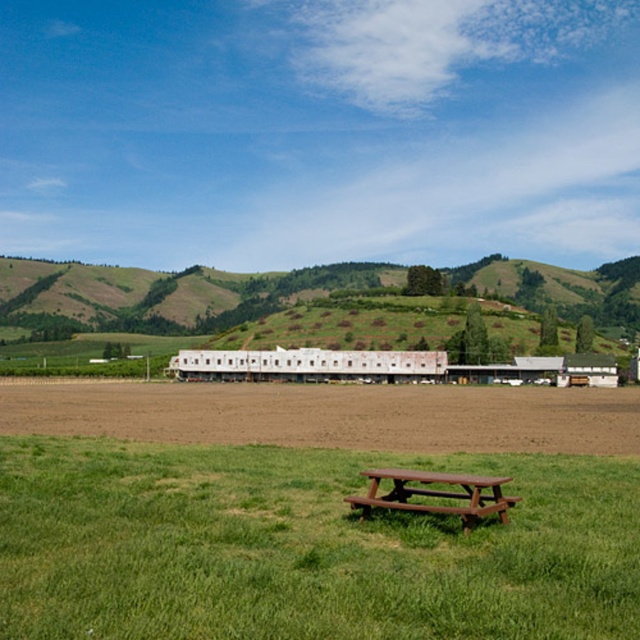
You are standing at the picnic table and want to walk to the farm structures. According to the coordinates provided, in which direction should you head from the green grassy field at center?

The green grassy field at center is located at point (x=305, y=547), so you should head towards the lower right direction to reach the farm structures.